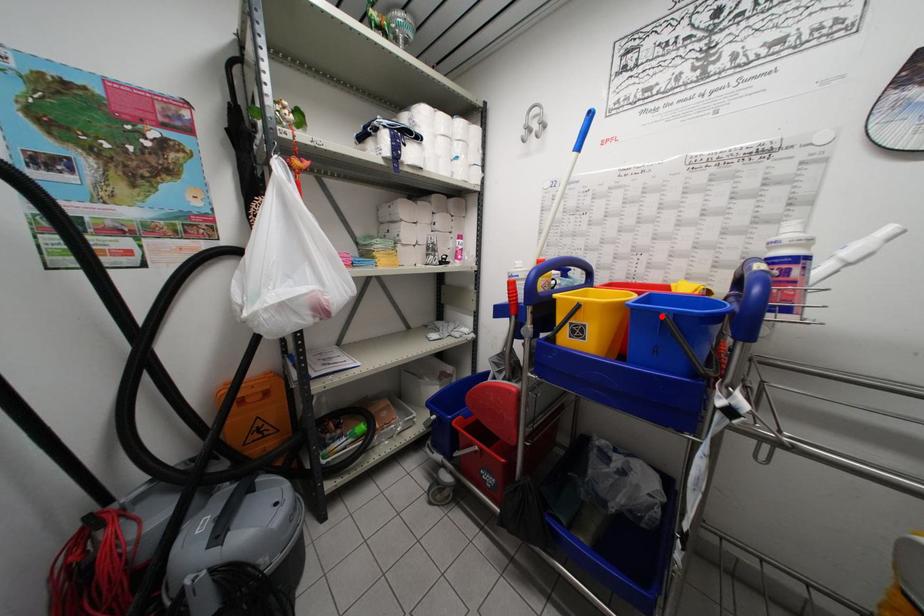
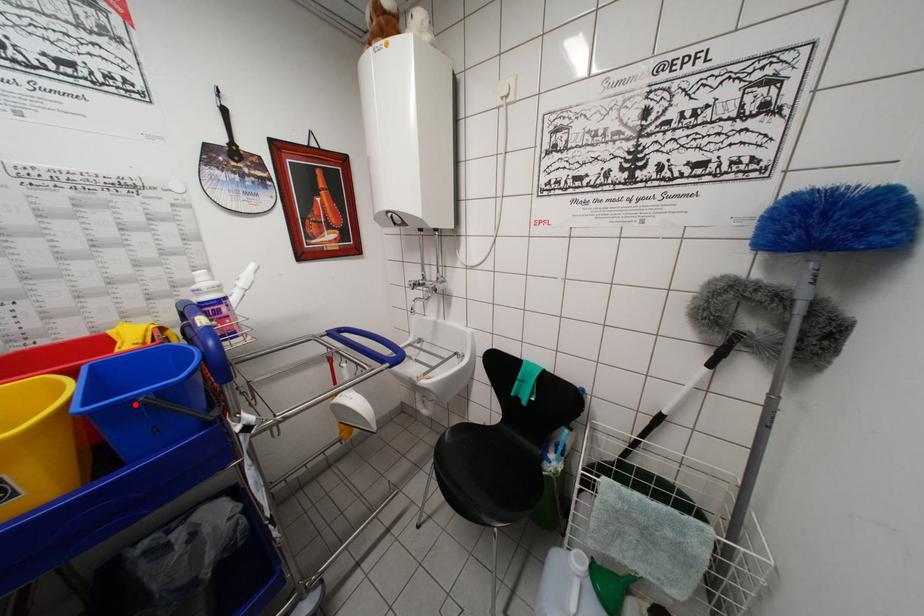
I am providing you with two images of the same scene from different viewpoints. A red point is marked on the first image and another point is marked on the second image. Do the highlighted points in image1 and image2 indicate the same real-world spot?

Yes